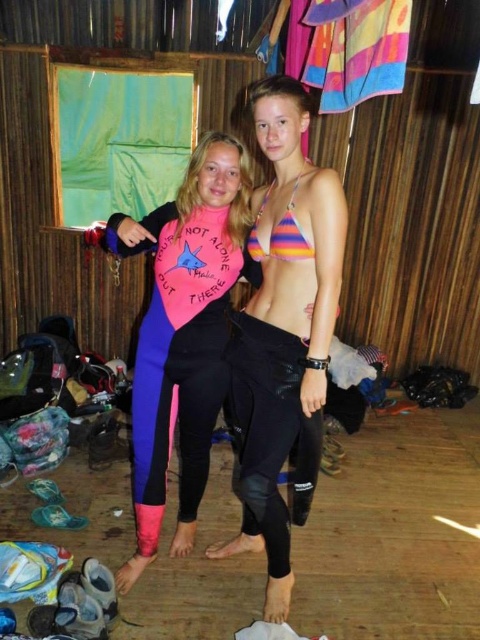
You are a photographer trying to capture the perfect shot of the striped fabric bikini top at center and the rainbow striped bikini top at center. Which one should you focus on first if you want to capture them from left to right order?

The rainbow striped bikini top at center should be focused on first because it is positioned to the left of the striped fabric bikini top at center.

You are a photographer trying to capture the rainbow striped bikini top at center and the pink neoprene wetsuit at center in a single shot. Which object will appear closer to the camera in the photo?

The pink neoprene wetsuit at center will appear closer to the camera because the rainbow striped bikini top at center is behind it.